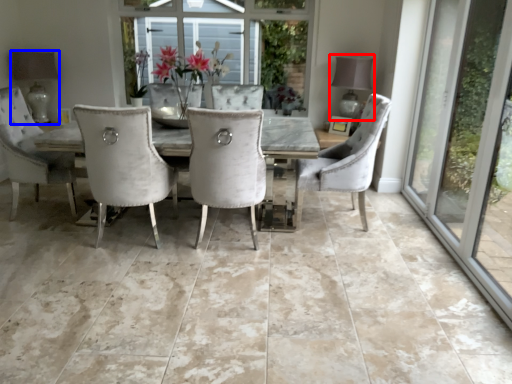
Question: Which point is further to the camera, lamp (highlighted by a red box) or lamp (highlighted by a blue box)?

Choices:
 (A) lamp
 (B) lamp

Answer: (B)